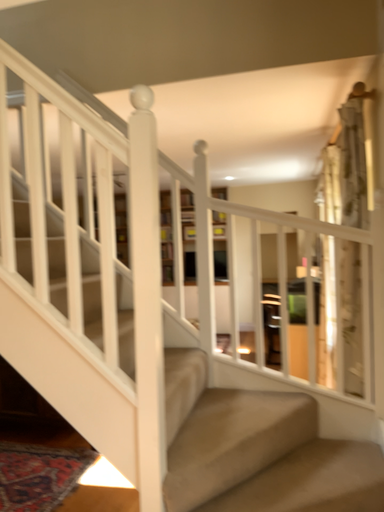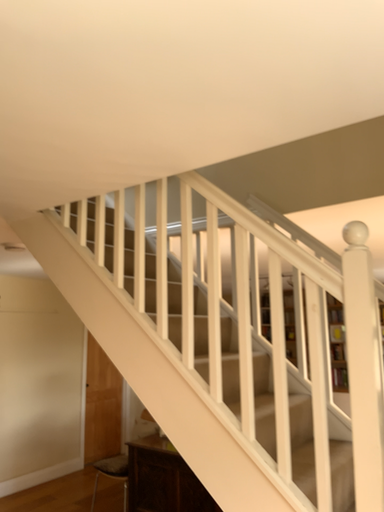
Question: Which way did the camera rotate in the video?

Choices:
 (A) rotated left
 (B) rotated right

Answer: (A)